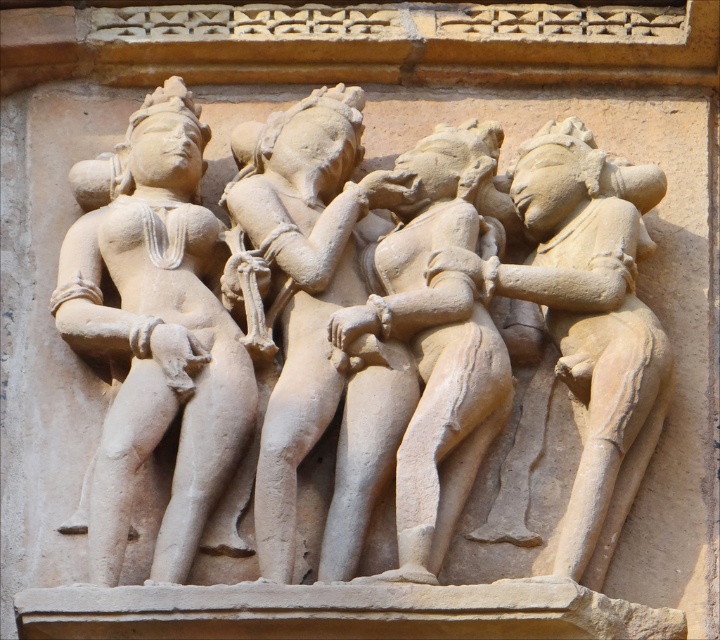
You are an art conservator examining the stone carvings. You notice two central figures in the carving, the beige stone sculpture at center and the matte stone statue at center. Which one is located to the right of the other?

The beige stone sculpture at center is positioned on the right side of the matte stone statue at center.

You are an architect designing a new temple and want to place a large statue in the courtyard. The statue you have in mind is exactly the same size as the matte stone statue at center from the carving. If the courtyard is 225.59 feet wide, will the statue fit comfortably without touching the edges?

The matte stone statue at center is 225.59 feet in width, so it will exactly fit the courtyard width of 225.59 feet. However, there will be no space left between the statue and the edges, so it might not be comfortable. Consider a slightly smaller statue or a wider courtyard for better spacing.

You are an archaeologist examining the stone carving. The beige stone sculpture at center is part of a larger composition. Can you determine its exact 2D coordinates within the image?

The beige stone sculpture at center is located at the 2D coordinates of point (x=441, y=323).